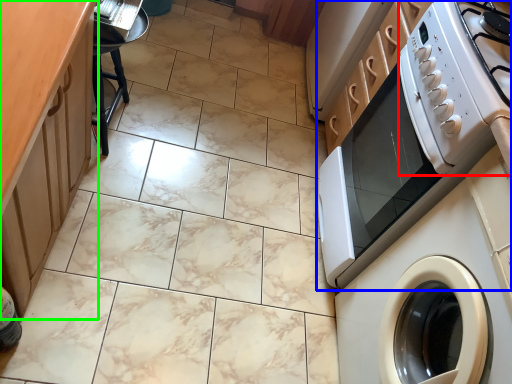
Question: Based on their relative distances, which object is farther from gas stove (highlighted by a red box)? Choose from home appliance (highlighted by a blue box) and counter top (highlighted by a green box).

Choices:
 (A) home appliance
 (B) counter top

Answer: (B)